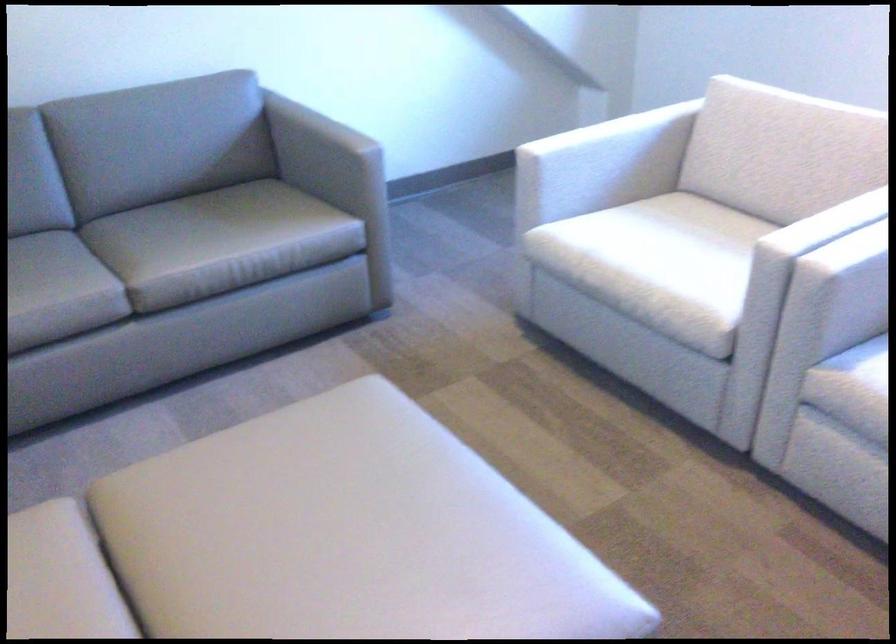
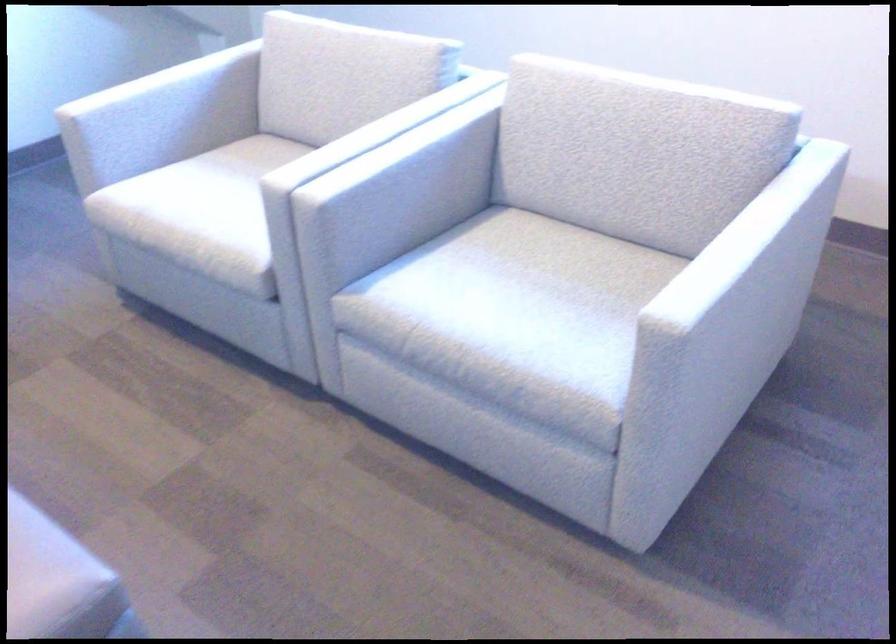
Question: The camera is either moving clockwise (left) or counter-clockwise (right) around the object. The first image is from the beginning of the video and the second image is from the end. Is the camera moving left or right when shooting the video?

Choices:
 (A) Left
 (B) Right

Answer: (A)